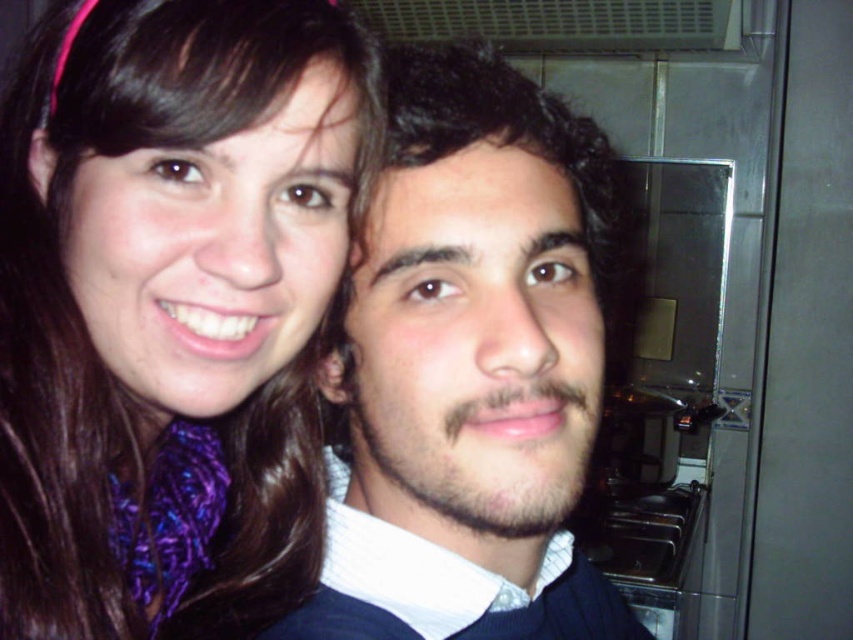
Does purple silky scarf at upper left have a larger size compared to dark brown curly hair at center?

No.

Is point (41, 172) positioned in front of point (421, 180)?

No, (41, 172) is further to viewer.

Is point (229, 588) closer to camera compared to point (480, 525)?

That is False.

Image resolution: width=853 pixels, height=640 pixels. What are the coordinates of `purple silky scarf at upper left` in the screenshot? It's located at (171, 308).